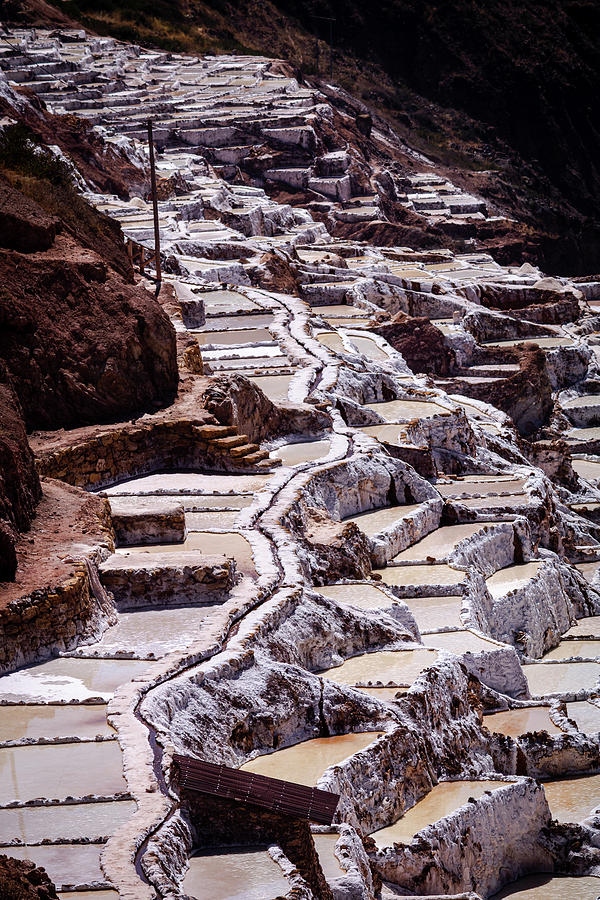
Find the location of a particular element. The width and height of the screenshot is (600, 900). stairs is located at coordinates (232, 441).